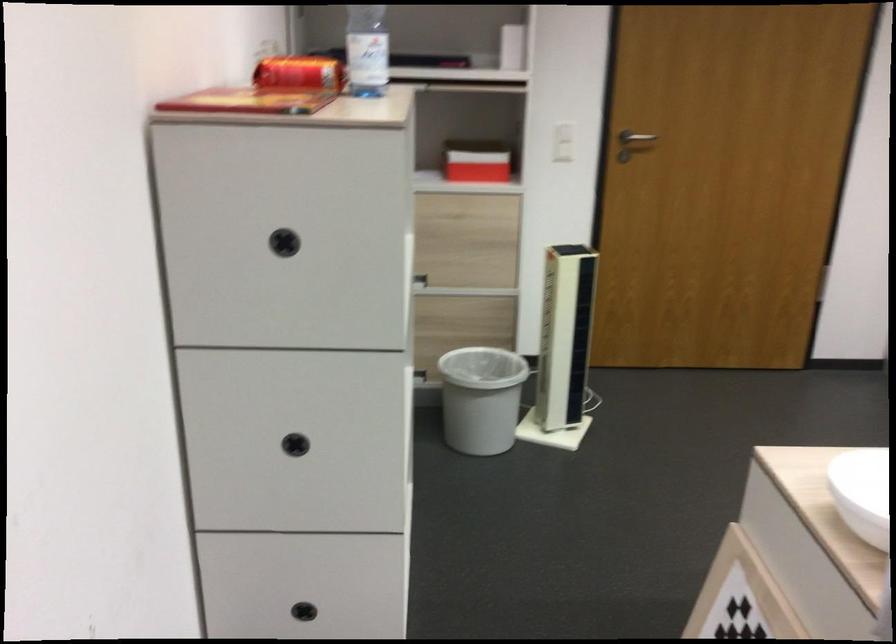
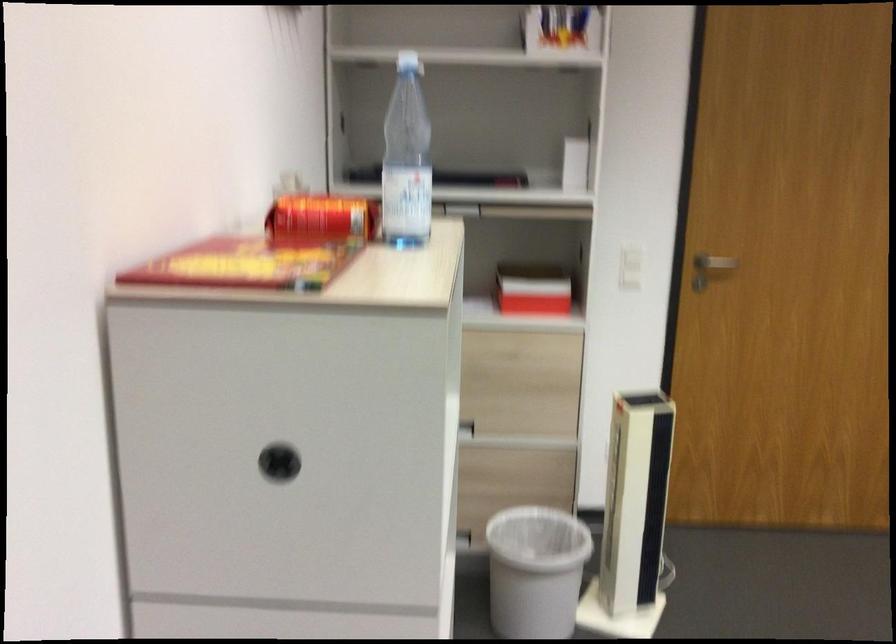
Question: What movement of the cameraman would produce the second image?

Choices:
 (A) Left
 (B) Right
 (C) Forward
 (D) Backward

Answer: (C)